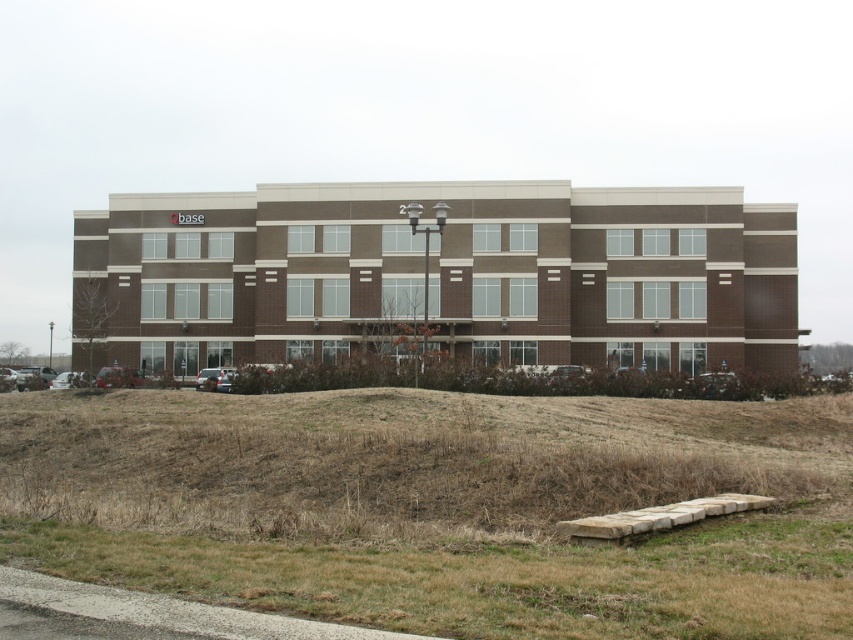
You are standing at the base of the commercial building and notice two points marked on the ground. One is labeled as point (669, 486) and the other as point (138, 561). From your current position, which point is closer to you?

Point (138, 561) is closer to you because it is in front of point (669, 486).